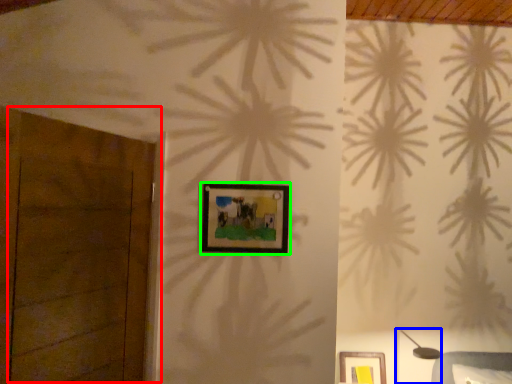
Question: Which is nearer to the door (highlighted by a red box)? table lamp (highlighted by a blue box) or picture frame (highlighted by a green box).

Choices:
 (A) table lamp
 (B) picture frame

Answer: (B)